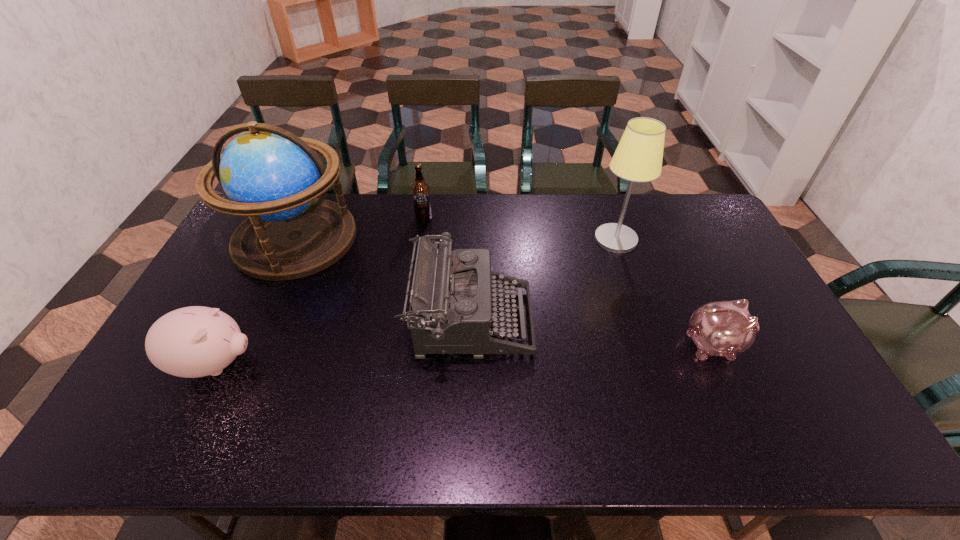
Image resolution: width=960 pixels, height=540 pixels. I want to click on object that is positioned at the far left corner, so click(269, 174).

This screenshot has width=960, height=540. In the image, there is a desktop. Find the location of `vacant space at the far edge`. vacant space at the far edge is located at coordinates (520, 195).

Find the location of a particular element. This screenshot has width=960, height=540. vacant space at the near edge of the desktop is located at coordinates (582, 423).

Where is `vacant area at the left edge`? vacant area at the left edge is located at coordinates (164, 410).

The width and height of the screenshot is (960, 540). In the image, there is a desktop. In order to click on vacant region at the right edge in this screenshot , I will do `click(832, 403)`.

Identify the location of free space at the far right corner. (673, 215).

Find the location of a particular element. vacant point located between the shorter piggy bank and the beer bottle is located at coordinates (568, 282).

What are the coordinates of `vacant area that lies between the beer bottle and the taller piggy bank` in the screenshot? It's located at (320, 291).

Find the location of a particular element. free space between the globe and the fifth object from left to right is located at coordinates (456, 239).

Locate an element on the screen. free space between the beer bottle and the second object from right to left is located at coordinates (519, 229).